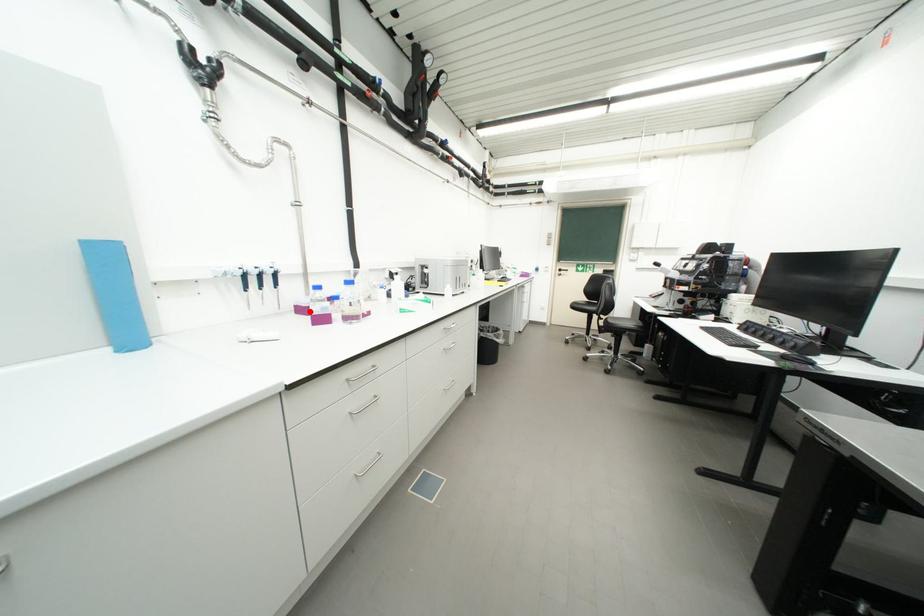
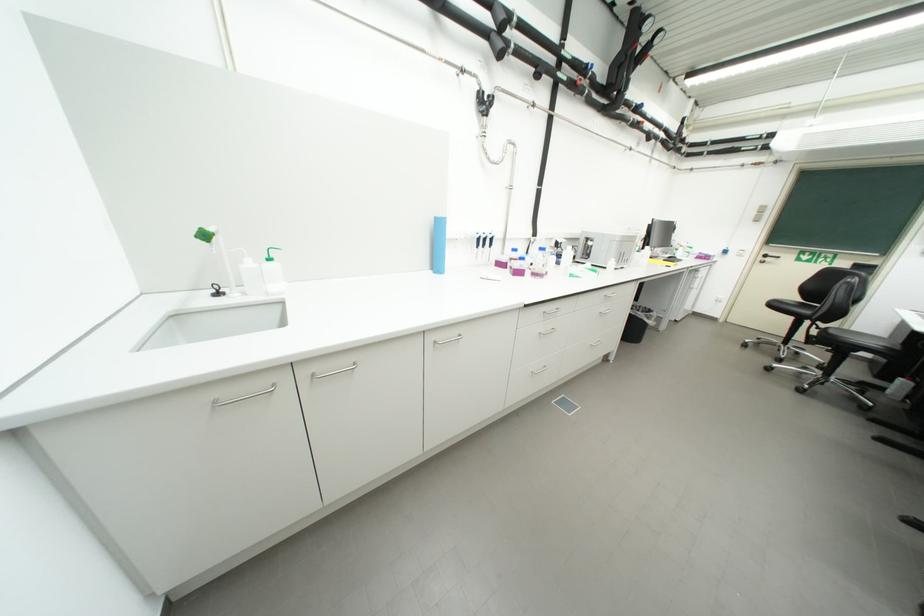
Find the pixel in the second image that matches the highlighted location in the first image.

(507, 265)